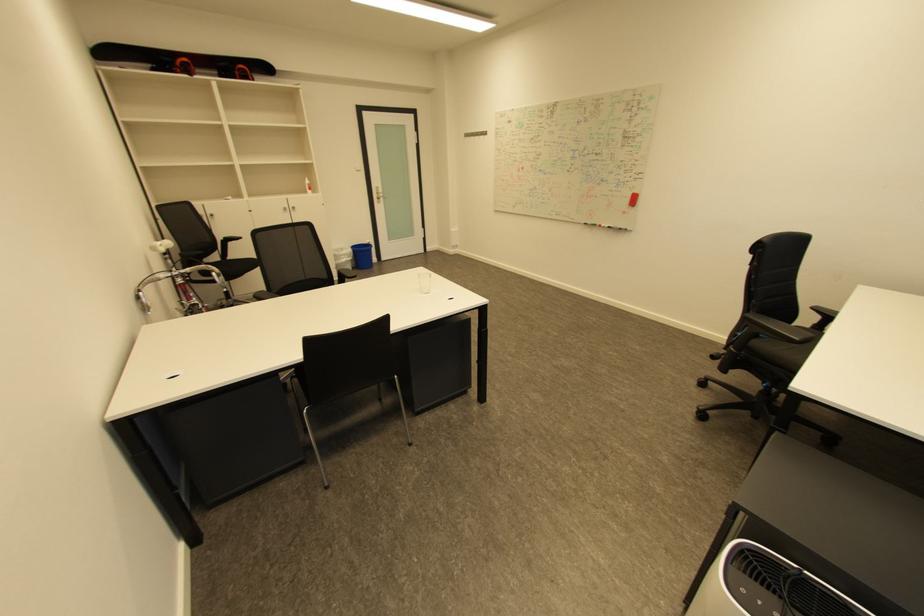
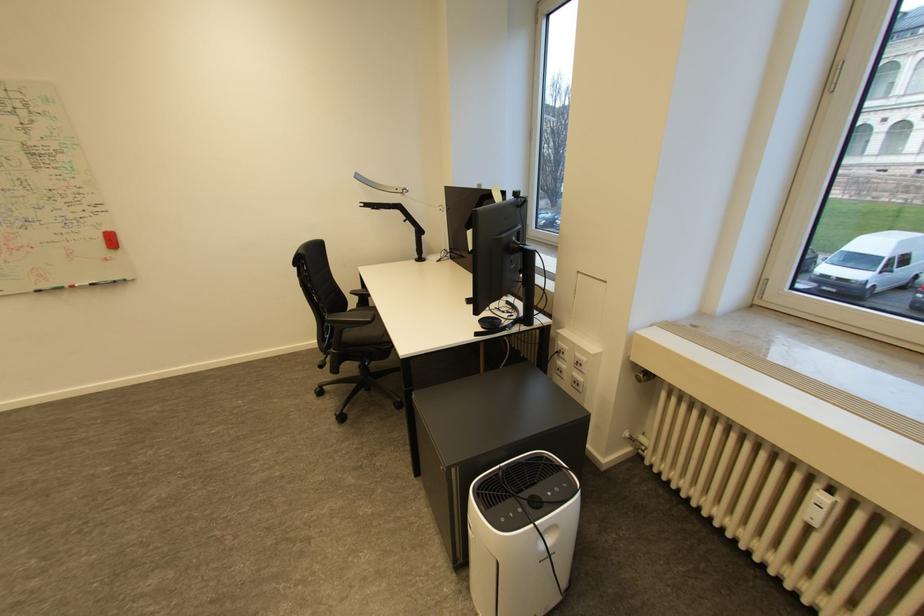
Locate, in the second image, the point that corresponds to the point at 610,225 in the first image.

(83, 286)